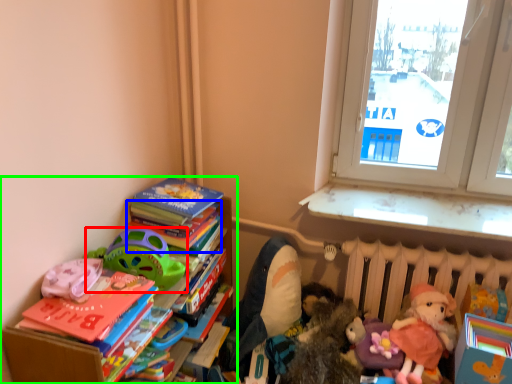
Question: Which object is positioned farthest from toy (highlighted by a red box)? Select from book (highlighted by a blue box) and bookcase (highlighted by a green box).

Choices:
 (A) book
 (B) bookcase

Answer: (B)